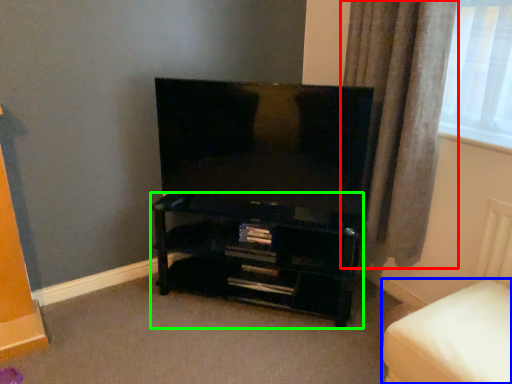
Question: Which is nearer to the curtain (highlighted by a red box)? furniture (highlighted by a blue box) or shelf (highlighted by a green box).

Choices:
 (A) furniture
 (B) shelf

Answer: (B)